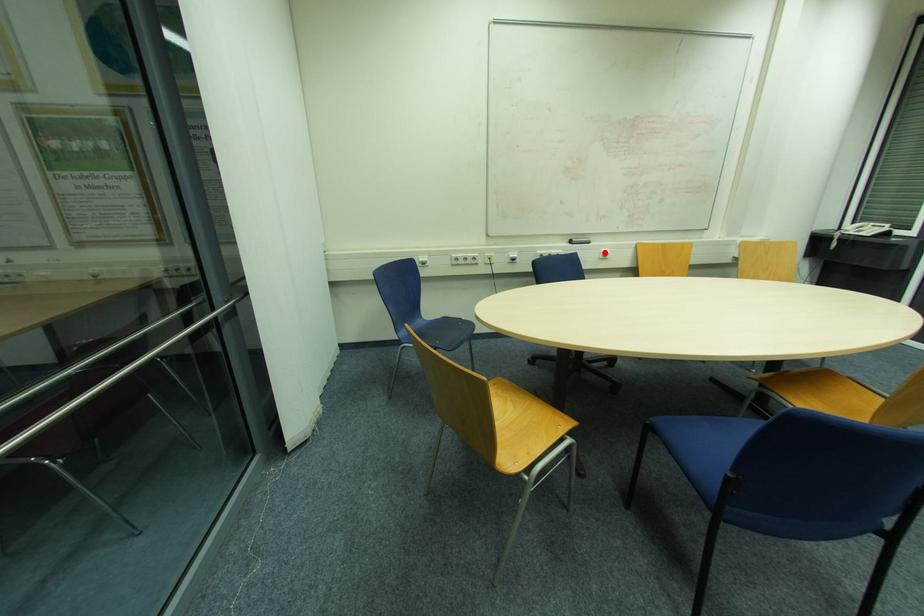
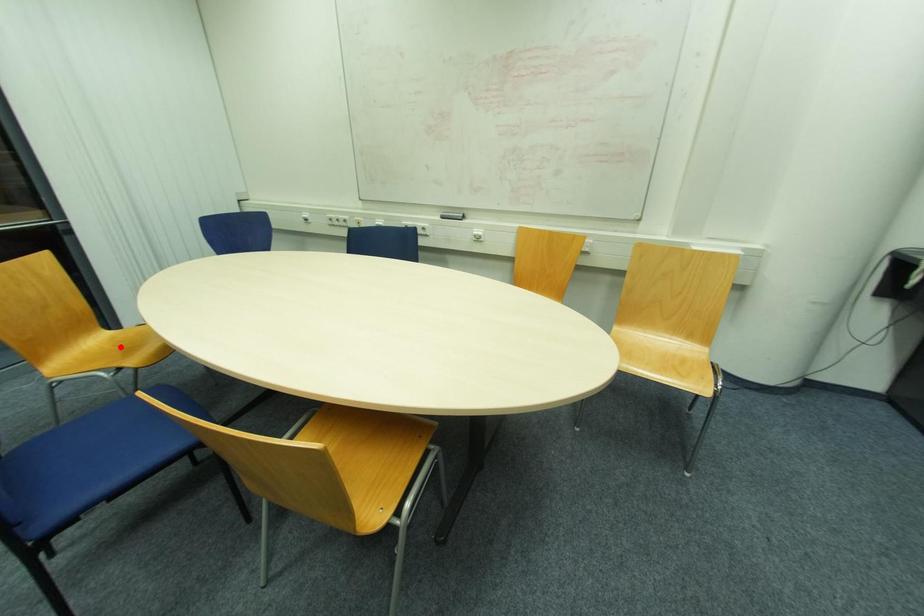
I am providing you with two images of the same scene from different viewpoints. A red point is marked on the first image and another point is marked on the second image. Does the point marked in image1 correspond to the same location as the one in image2?

No